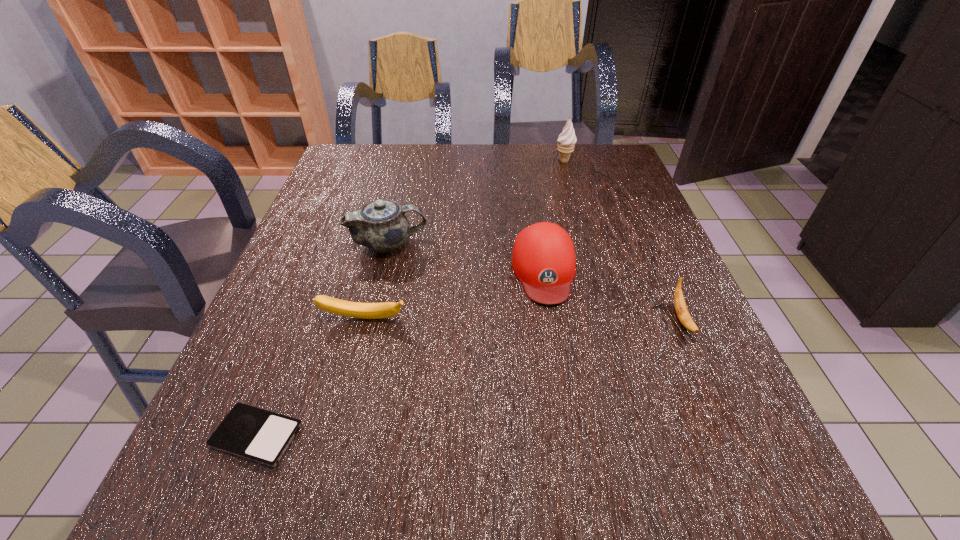
What are the coordinates of `the farthest object` in the screenshot? It's located at (566, 140).

Locate an element on the screen. The image size is (960, 540). icecream is located at coordinates (566, 140).

You are a GUI agent. You are given a task and a screenshot of the screen. Output one action in this format:
    pyautogui.click(x=<x>, y=<y>)
    Task: Click on the chinaware
    This screenshot has height=540, width=960.
    Given the screenshot: What is the action you would take?
    pyautogui.click(x=380, y=225)

Where is `baseball cap`? This screenshot has height=540, width=960. baseball cap is located at coordinates (543, 259).

The height and width of the screenshot is (540, 960). I want to click on the fourth object from left to right, so click(543, 259).

Locate an element on the screen. the right banana is located at coordinates (681, 309).

At what (x,y) coordinates should I click in order to perform the action: click on the left banana. Please return your answer as a coordinate pair (x, y). This screenshot has width=960, height=540. Looking at the image, I should click on (333, 305).

Find the location of a particular element. iPod is located at coordinates (262, 436).

What are the coordinates of `the nearest object` in the screenshot? It's located at (262, 436).

Where is `free region located on the front-facing side of the fifth object from left to right`? The width and height of the screenshot is (960, 540). free region located on the front-facing side of the fifth object from left to right is located at coordinates tap(464, 161).